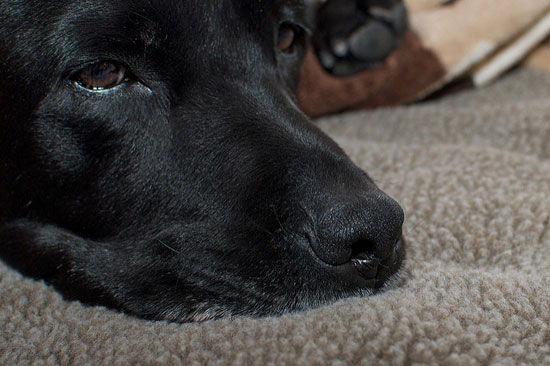
Identify the location of beige and gray carpet. This screenshot has width=550, height=366. (401, 308).